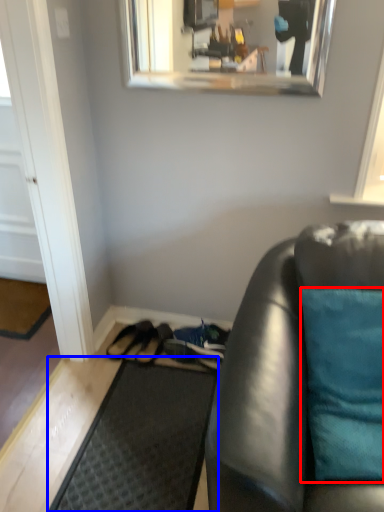
Question: Which object appears farthest to the camera in this image, pillow (highlighted by a red box) or doormat (highlighted by a blue box)?

Choices:
 (A) pillow
 (B) doormat

Answer: (B)